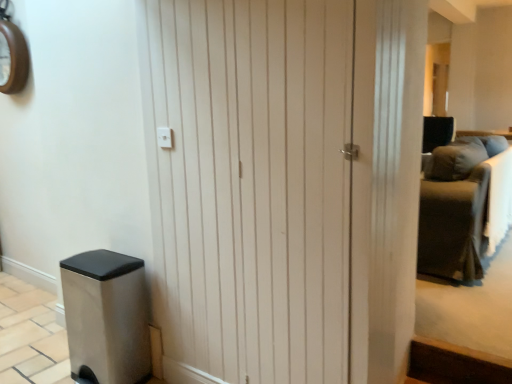
Question: Considering the relative sizes of dark gray fabric couch at right and white wood door at center in the image provided, is dark gray fabric couch at right taller than white wood door at center?

Choices:
 (A) yes
 (B) no

Answer: (B)

Question: Is dark gray fabric couch at right to the left of white wood door at center from the viewer's perspective?

Choices:
 (A) yes
 (B) no

Answer: (B)

Question: From the image's perspective, is dark gray fabric couch at right over white wood door at center?

Choices:
 (A) yes
 (B) no

Answer: (A)

Question: Is dark gray fabric couch at right thinner than white wood door at center?

Choices:
 (A) yes
 (B) no

Answer: (B)

Question: From the image's perspective, is dark gray fabric couch at right located beneath white wood door at center?

Choices:
 (A) no
 (B) yes

Answer: (A)

Question: Is point (306, 327) positioned closer to the camera than point (23, 79)?

Choices:
 (A) closer
 (B) farther

Answer: (A)

Question: From a real-world perspective, is white wood door at center physically located above or below wooden clock at upper left?

Choices:
 (A) above
 (B) below

Answer: (B)

Question: In the image, is white wood door at center on the left side or the right side of wooden clock at upper left?

Choices:
 (A) left
 (B) right

Answer: (B)

Question: In terms of width, does white wood door at center look wider or thinner when compared to wooden clock at upper left?

Choices:
 (A) thin
 (B) wide

Answer: (A)

Question: Visually, is wooden clock at upper left positioned to the left or to the right of dark gray fabric couch at right?

Choices:
 (A) left
 (B) right

Answer: (A)

Question: Considering the positions of point (6, 1) and point (484, 223), is point (6, 1) closer or farther from the camera than point (484, 223)?

Choices:
 (A) farther
 (B) closer

Answer: (A)

Question: Is wooden clock at upper left taller or shorter than dark gray fabric couch at right?

Choices:
 (A) short
 (B) tall

Answer: (A)

Question: Is wooden clock at upper left situated inside dark gray fabric couch at right or outside?

Choices:
 (A) outside
 (B) inside

Answer: (A)

Question: In terms of size, does white wood door at center appear bigger or smaller than dark gray fabric couch at right?

Choices:
 (A) big
 (B) small

Answer: (B)

Question: Is point tap(196, 314) positioned closer to the camera than point tap(479, 201)?

Choices:
 (A) closer
 (B) farther

Answer: (A)